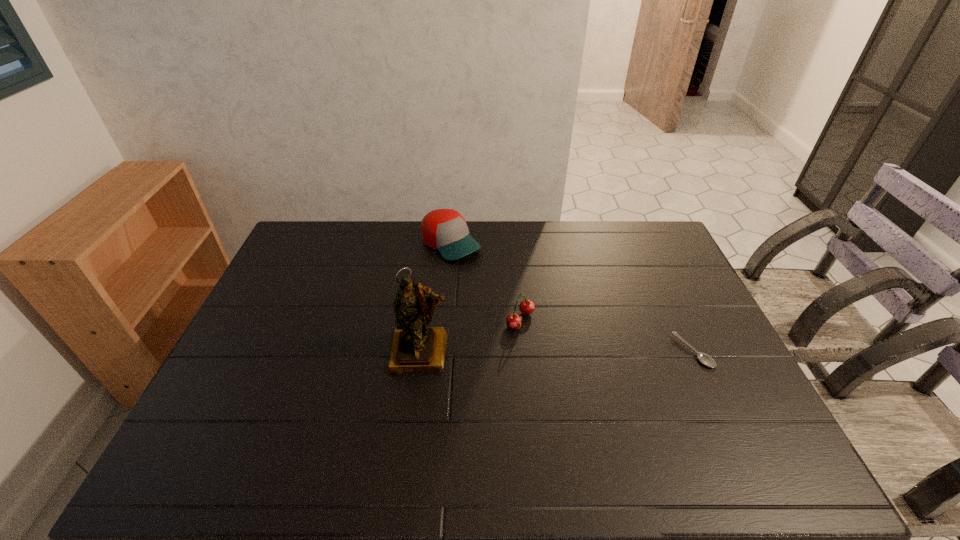
I want to click on the tallest object, so click(414, 347).

Locate an element on the screen. the rightmost object is located at coordinates tap(705, 359).

Locate an element on the screen. This screenshot has width=960, height=540. the shortest object is located at coordinates (705, 359).

This screenshot has height=540, width=960. In order to click on baseball cap in this screenshot , I will do `click(445, 230)`.

Locate an element on the screen. cherry is located at coordinates (513, 321).

This screenshot has height=540, width=960. I want to click on free space located on the front-facing side of the tallest object, so click(413, 415).

The width and height of the screenshot is (960, 540). I want to click on blank space located 0.090m on the left of the soupspoon, so click(645, 352).

Where is `free space located 0.080m at the brim of the farthest object`? free space located 0.080m at the brim of the farthest object is located at coordinates (482, 272).

Locate an element on the screen. This screenshot has width=960, height=540. vacant point located at the brim of the farthest object is located at coordinates (498, 286).

In order to click on vacant space located 0.190m at the brim of the farthest object in this screenshot , I will do `click(502, 289)`.